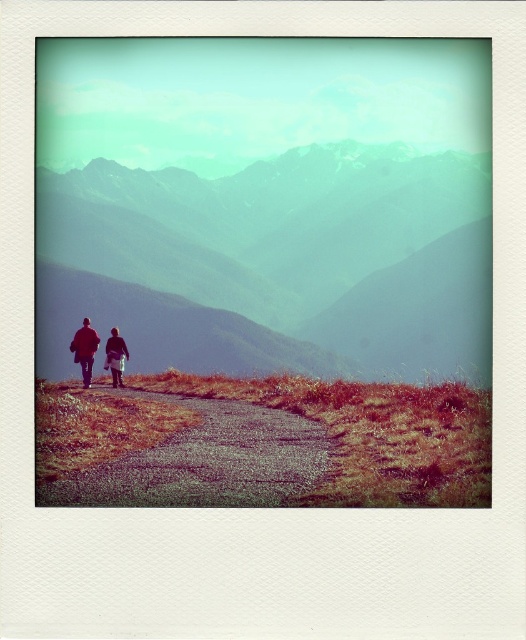
Question: Does green textured mountains at upper center have a lesser width compared to brown leather jacket at lower left?

Choices:
 (A) yes
 (B) no

Answer: (B)

Question: Is green textured mountains at upper center thinner than brown leather jacket at lower left?

Choices:
 (A) no
 (B) yes

Answer: (A)

Question: Which point is closer to the camera?

Choices:
 (A) brown leather jacket at lower left
 (B) green textured mountains at upper center
 (C) red woolen jacket at left

Answer: (A)

Question: Is brown leather jacket at lower left bigger than red woolen jacket at left?

Choices:
 (A) yes
 (B) no

Answer: (B)

Question: Which point is farther to the camera?

Choices:
 (A) (83, 368)
 (B) (138, 204)

Answer: (B)

Question: Which object is the farthest from the red woolen jacket at left?

Choices:
 (A) green textured mountains at upper center
 (B) brown leather jacket at lower left

Answer: (A)